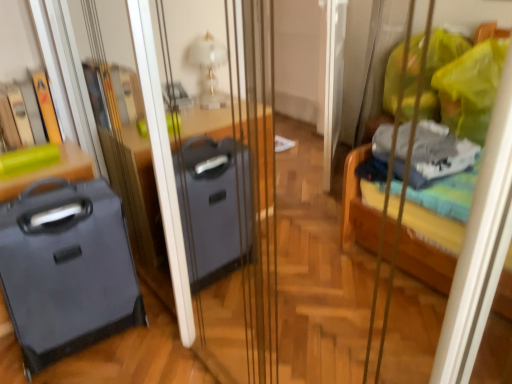
Locate an element on the screen. vacant region below matte black suitcase at left (from a real-world perspective) is located at coordinates (87, 348).